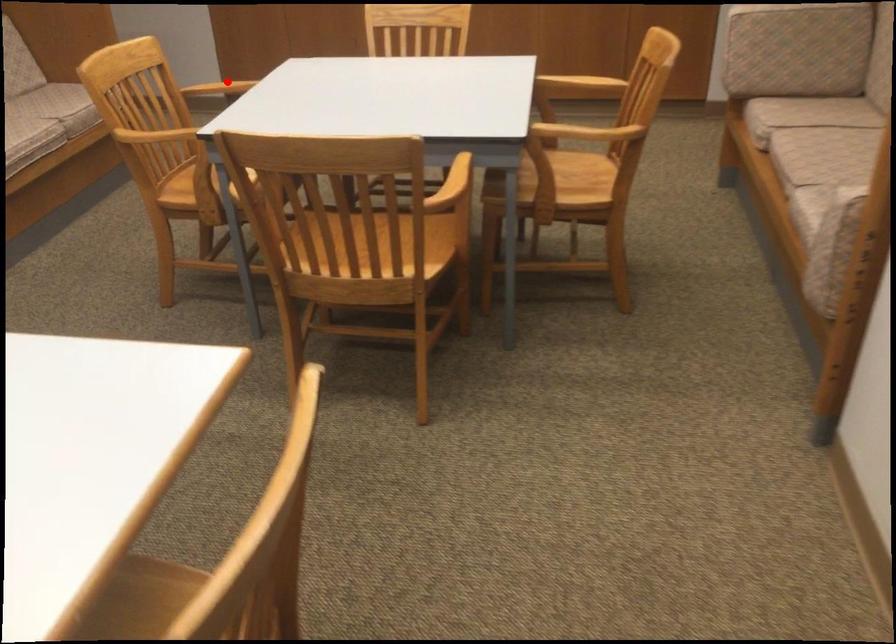
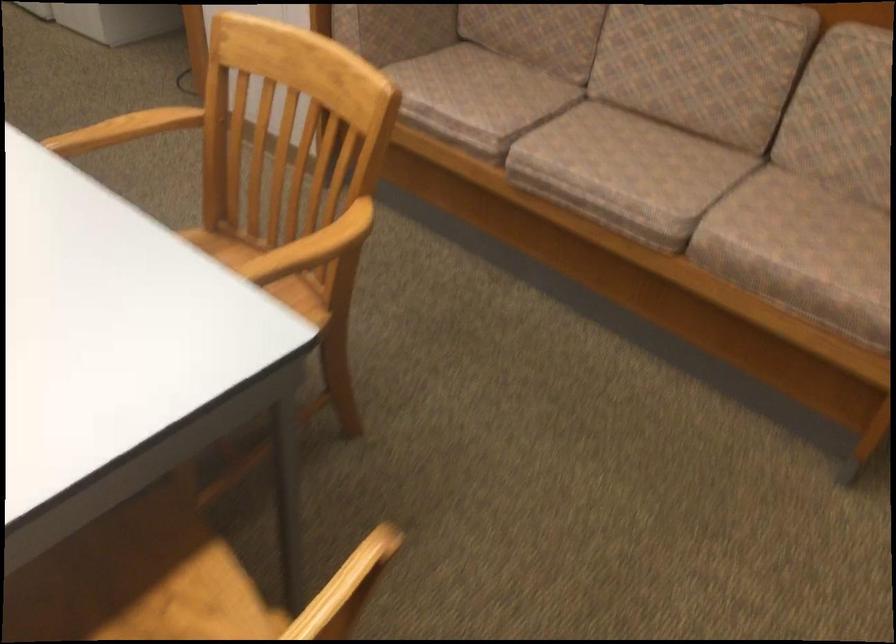
Locate, in the second image, the point that corresponds to the highlighted location in the first image.

(313, 247)